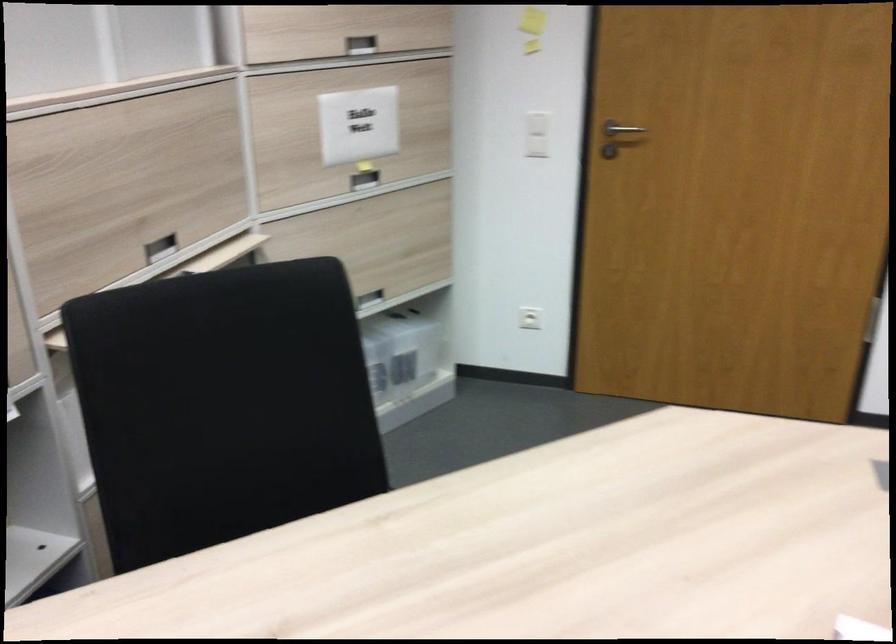
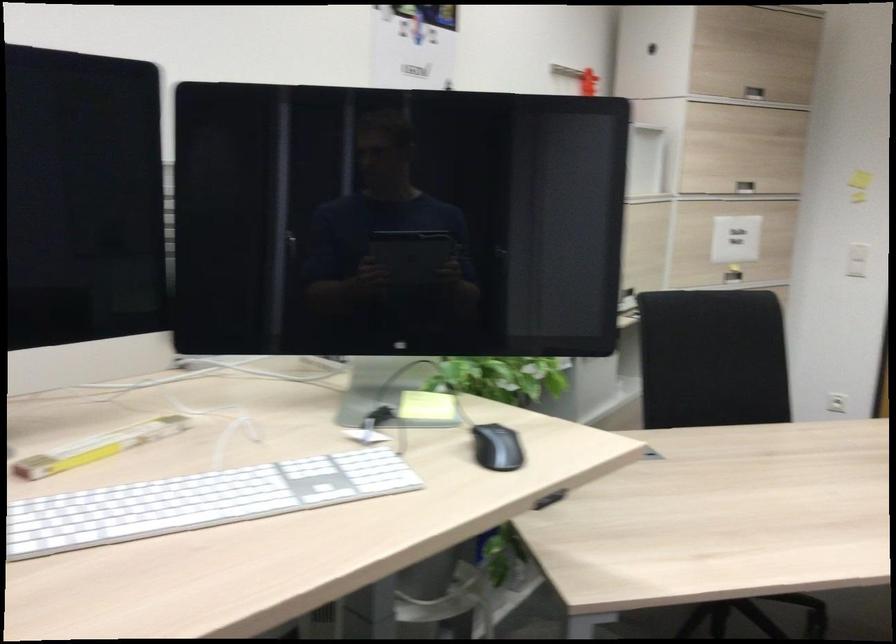
Locate, in the second image, the point that corresponds to point 342,128 in the first image.

(736, 239)